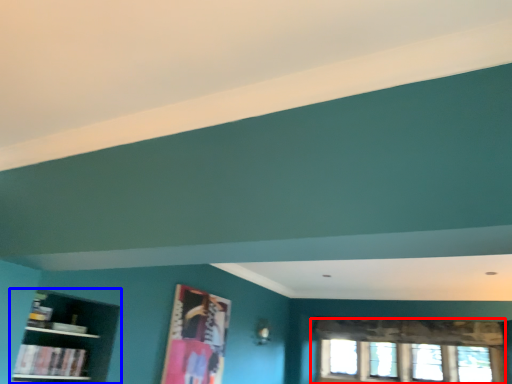
Question: Which object is closer to the camera taking this photo, window (highlighted by a red box) or shelf (highlighted by a blue box)?

Choices:
 (A) window
 (B) shelf

Answer: (B)